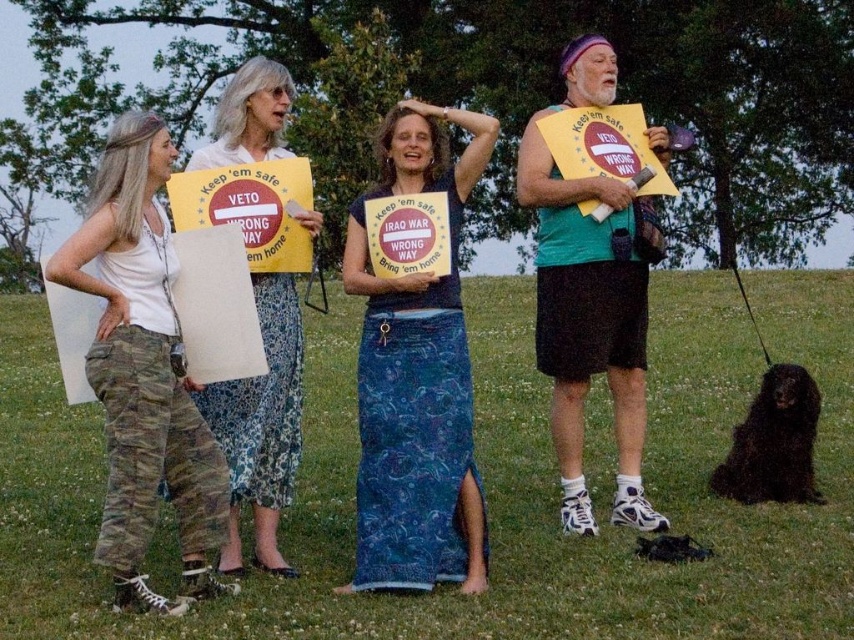
Is blue denim skirt at center to the right of black silky fur at lower right from the viewer's perspective?

In fact, blue denim skirt at center is to the left of black silky fur at lower right.

Is blue denim skirt at center positioned behind black silky fur at lower right?

No, it is not.

Locate an element on the screen. blue denim skirt at center is located at coordinates (416, 376).

Which is behind, point (232, 403) or point (791, 474)?

Positioned behind is point (791, 474).

Which is above, floral skirt at center or black silky fur at lower right?

Positioned higher is floral skirt at center.

I want to click on floral skirt at center, so click(261, 426).

Can you confirm if camouflage pants at left is positioned above black silky fur at lower right?

Indeed, camouflage pants at left is positioned over black silky fur at lower right.

Does camouflage pants at left have a smaller size compared to black silky fur at lower right?

No.

Is point (162, 177) behind point (759, 390)?

That is False.

In order to click on camouflage pants at left in this screenshot , I will do (x=143, y=372).